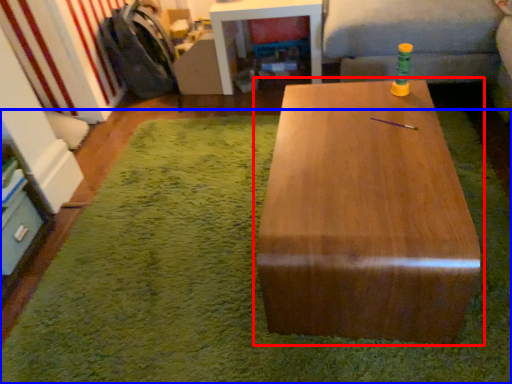
Question: Which object appears closest to the camera in this image, table (highlighted by a red box) or mat (highlighted by a blue box)?

Choices:
 (A) table
 (B) mat

Answer: (A)